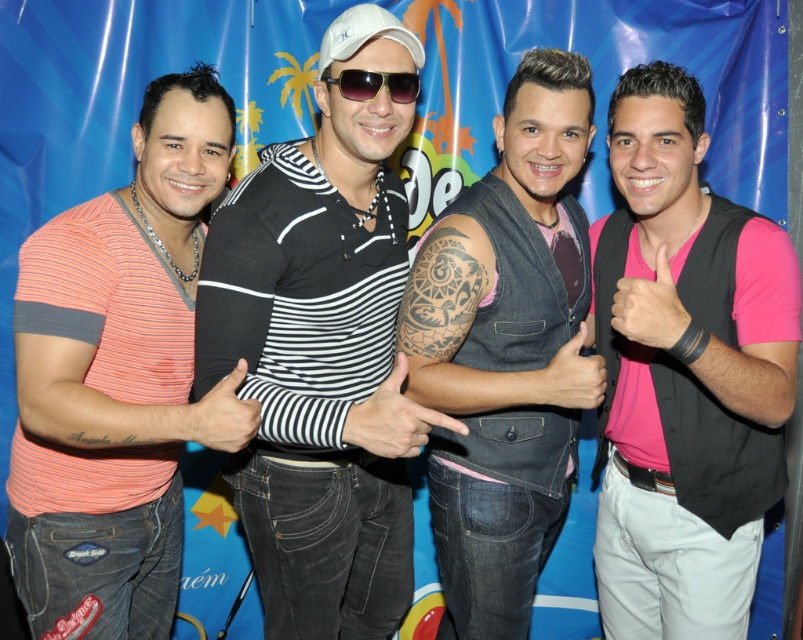
You are a GUI agent. You are given a task and a screenshot of the screen. Output one action in this format:
    pyautogui.click(x=<x>, y=<y>)
    Task: Click on the black striped shirt at center
    
    Given the screenshot: What is the action you would take?
    pyautogui.click(x=321, y=352)

Does black striped shirt at center appear on the left side of sunglasses at center?

Indeed, black striped shirt at center is positioned on the left side of sunglasses at center.

In order to click on black striped shirt at center in this screenshot , I will do `click(321, 352)`.

Find the location of a particular element. black striped shirt at center is located at coordinates (321, 352).

In the scene shown: Can you confirm if black striped shirt at center is bigger than matte coral striped shirt at left?

Actually, black striped shirt at center might be smaller than matte coral striped shirt at left.

Is point (341, 104) farther from viewer compared to point (159, 369)?

That is False.

Where is `black striped shirt at center`? black striped shirt at center is located at coordinates (321, 352).

Does pink matte vest at right appear on the left side of matte coral striped shirt at left?

Incorrect, pink matte vest at right is not on the left side of matte coral striped shirt at left.

Is pink matte vest at right shorter than matte coral striped shirt at left?

No, pink matte vest at right is not shorter than matte coral striped shirt at left.

Who is more forward, (651, 284) or (94, 321)?

Point (651, 284) is in front.

You are a GUI agent. You are given a task and a screenshot of the screen. Output one action in this format:
    pyautogui.click(x=<x>, y=<y>)
    Task: Click on the pink matte vest at right
    This screenshot has width=803, height=640.
    Given the screenshot: What is the action you would take?
    pyautogui.click(x=683, y=372)